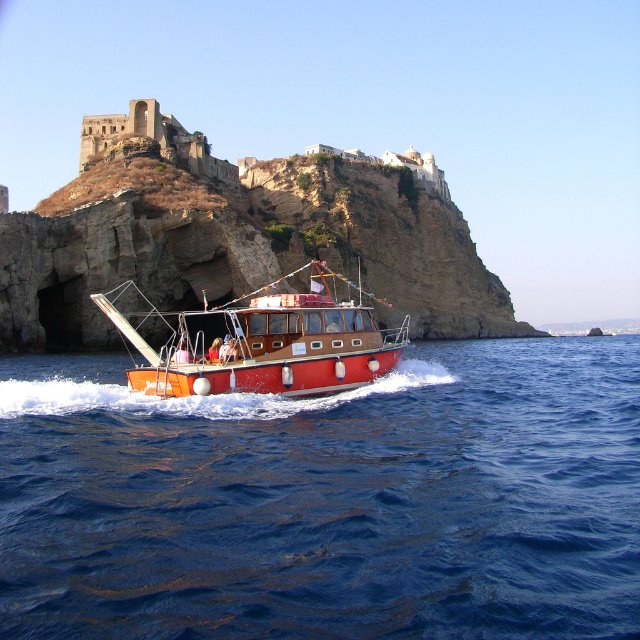
Question: Does blue liquid water at center have a greater width compared to shiny red boat at center?

Choices:
 (A) yes
 (B) no

Answer: (A)

Question: Which point is closer to the camera?

Choices:
 (A) (376, 352)
 (B) (26, 472)

Answer: (B)

Question: Is blue liquid water at center in front of shiny red boat at center?

Choices:
 (A) yes
 (B) no

Answer: (A)

Question: Which point is closer to the camera?

Choices:
 (A) (404, 412)
 (B) (241, 385)

Answer: (B)

Question: Does blue liquid water at center come behind shiny red boat at center?

Choices:
 (A) yes
 (B) no

Answer: (B)